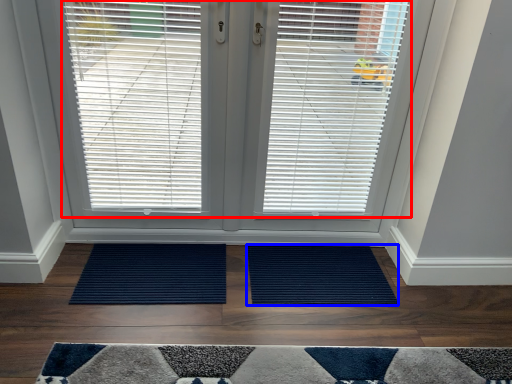
Question: Among these objects, which one is nearest to the camera, window blind (highlighted by a red box) or doormat (highlighted by a blue box)?

Choices:
 (A) window blind
 (B) doormat

Answer: (A)